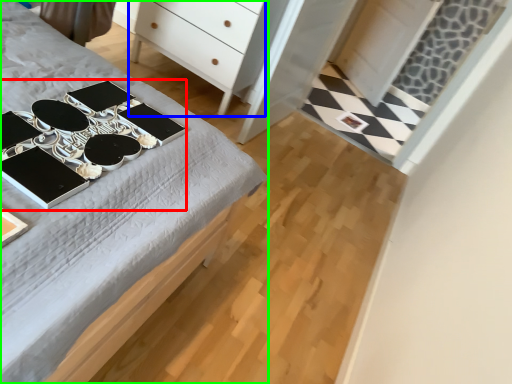
Question: Considering the real-world distances, which object is closest to changing table (highlighted by a red box)? chest of drawers (highlighted by a blue box) or desk (highlighted by a green box).

Choices:
 (A) chest of drawers
 (B) desk

Answer: (B)